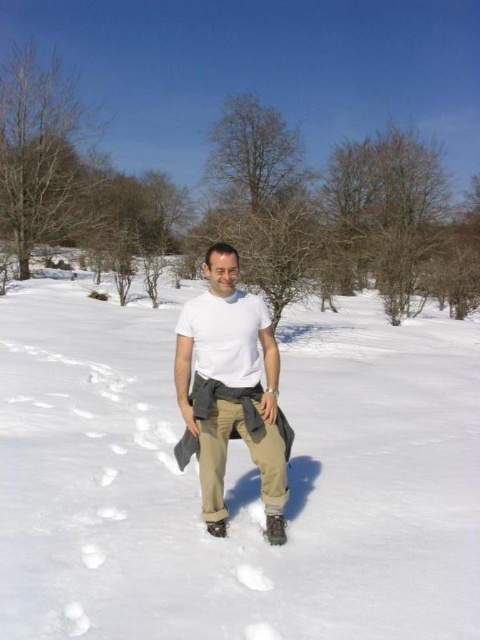
Question: Can you confirm if white fluffy snow at center is bigger than white matte t-shirt at center?

Choices:
 (A) yes
 (B) no

Answer: (A)

Question: Which object appears farthest from the camera in this image?

Choices:
 (A) white matte shirt at center
 (B) white fluffy snow at center
 (C) white matte t-shirt at center

Answer: (A)

Question: Is white matte t-shirt at center above white matte shirt at center?

Choices:
 (A) no
 (B) yes

Answer: (A)

Question: From the image, what is the correct spatial relationship of white fluffy snow at center in relation to white matte t-shirt at center?

Choices:
 (A) right
 (B) left

Answer: (A)

Question: Estimate the real-world distances between objects in this image. Which object is farther from the white matte shirt at center?

Choices:
 (A) white matte t-shirt at center
 (B) white fluffy snow at center

Answer: (B)

Question: Among these objects, which one is farthest from the camera?

Choices:
 (A) white fluffy snow at center
 (B) white matte t-shirt at center

Answer: (B)